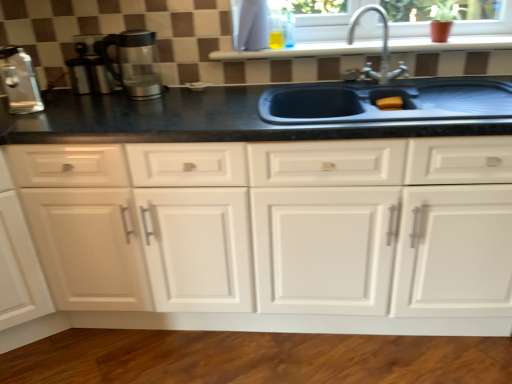
Question: From a real-world perspective, is satin nickel faucet at upper right physically below white glossy window sill at upper center?

Choices:
 (A) no
 (B) yes

Answer: (A)

Question: Is satin nickel faucet at upper right outside white glossy window sill at upper center?

Choices:
 (A) yes
 (B) no

Answer: (A)

Question: From the image's perspective, is satin nickel faucet at upper right located above white glossy window sill at upper center?

Choices:
 (A) yes
 (B) no

Answer: (B)

Question: Can you confirm if satin nickel faucet at upper right is smaller than white glossy window sill at upper center?

Choices:
 (A) no
 (B) yes

Answer: (B)

Question: Is satin nickel faucet at upper right closer to camera compared to white glossy window sill at upper center?

Choices:
 (A) no
 (B) yes

Answer: (B)

Question: Is satin nickel faucet at upper right taller than white glossy window sill at upper center?

Choices:
 (A) no
 (B) yes

Answer: (B)

Question: Is transparent glass coffee maker at left, which is the first coffee machine from right to left, placed right next to black matte sink at center?

Choices:
 (A) no
 (B) yes

Answer: (A)

Question: Is transparent glass coffee maker at left, which is the second coffee machine from left to right, to the left of black matte sink at center from the viewer's perspective?

Choices:
 (A) no
 (B) yes

Answer: (B)

Question: From the image's perspective, is transparent glass coffee maker at left, which is the second coffee machine from left to right, located above black matte sink at center?

Choices:
 (A) yes
 (B) no

Answer: (A)

Question: Is transparent glass coffee maker at left, which is the first coffee machine from right to left, closer to the viewer compared to black matte sink at center?

Choices:
 (A) no
 (B) yes

Answer: (A)

Question: From a real-world perspective, is transparent glass coffee maker at left, which is the second coffee machine from left to right, located higher than black matte sink at center?

Choices:
 (A) no
 (B) yes

Answer: (B)

Question: From the image's perspective, would you say transparent glass coffee maker at left, which is the second coffee machine from left to right, is shown under black matte sink at center?

Choices:
 (A) yes
 (B) no

Answer: (B)

Question: Is white glossy window sill at upper center shorter than transparent glass coffee maker at left, which is the second coffee machine from left to right?

Choices:
 (A) yes
 (B) no

Answer: (A)